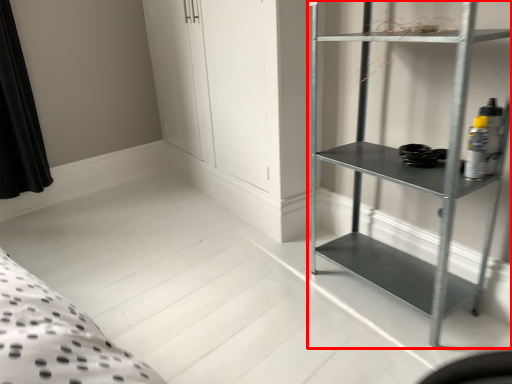
Question: Observing the image, what is the correct spatial positioning of shelf (annotated by the red box) in reference to cabinet?

Choices:
 (A) left
 (B) right

Answer: (A)